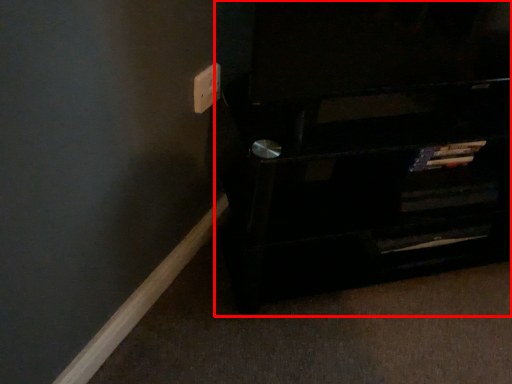
Question: From the image's perspective, what is the correct spatial positioning of furniture (annotated by the red box) in reference to electric outlet?

Choices:
 (A) below
 (B) above

Answer: (A)